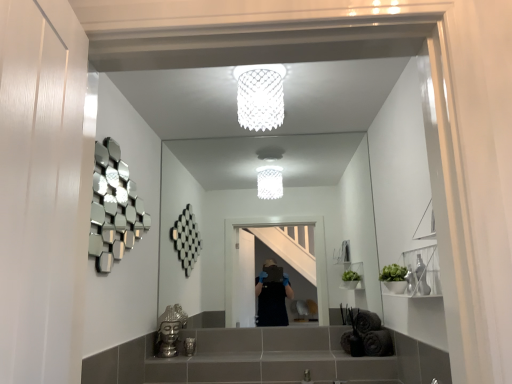
Question: Is there a large distance between clear glass mirror at center and white mesh light fixture at upper center?

Choices:
 (A) yes
 (B) no

Answer: (A)

Question: Considering the relative sizes of clear glass mirror at center and white mesh light fixture at upper center in the image provided, is clear glass mirror at center wider than white mesh light fixture at upper center?

Choices:
 (A) no
 (B) yes

Answer: (A)

Question: From the image's perspective, is clear glass mirror at center beneath white mesh light fixture at upper center?

Choices:
 (A) no
 (B) yes

Answer: (B)

Question: Is clear glass mirror at center bigger than white mesh light fixture at upper center?

Choices:
 (A) yes
 (B) no

Answer: (A)

Question: Is white mesh light fixture at upper center inside clear glass mirror at center?

Choices:
 (A) no
 (B) yes

Answer: (A)

Question: Based on their sizes in the image, would you say white mesh light fixture at upper center is bigger or smaller than metallic silver toiletry at lower center?

Choices:
 (A) big
 (B) small

Answer: (A)

Question: Considering the positions of white mesh light fixture at upper center and metallic silver toiletry at lower center in the image, is white mesh light fixture at upper center wider or thinner than metallic silver toiletry at lower center?

Choices:
 (A) wide
 (B) thin

Answer: (A)

Question: Is white mesh light fixture at upper center to the left or to the right of metallic silver toiletry at lower center in the image?

Choices:
 (A) left
 (B) right

Answer: (B)

Question: Considering the positions of point (250, 122) and point (193, 340), is point (250, 122) closer or farther from the camera than point (193, 340)?

Choices:
 (A) farther
 (B) closer

Answer: (B)

Question: Relative to gold metallic buddha head at lower center, is metallic silver toiletry at lower center in front or behind?

Choices:
 (A) front
 (B) behind

Answer: (B)

Question: Looking at their shapes, would you say metallic silver toiletry at lower center is wider or thinner than gold metallic buddha head at lower center?

Choices:
 (A) thin
 (B) wide

Answer: (A)

Question: In the image, is metallic silver toiletry at lower center on the left side or the right side of gold metallic buddha head at lower center?

Choices:
 (A) right
 (B) left

Answer: (A)

Question: From the image's perspective, is metallic silver toiletry at lower center positioned above or below gold metallic buddha head at lower center?

Choices:
 (A) above
 (B) below

Answer: (B)

Question: Does point (186, 339) appear closer or farther from the camera than point (352, 225)?

Choices:
 (A) closer
 (B) farther

Answer: (A)

Question: Is metallic silver toiletry at lower center inside or outside of clear glass mirror at center?

Choices:
 (A) inside
 (B) outside

Answer: (B)